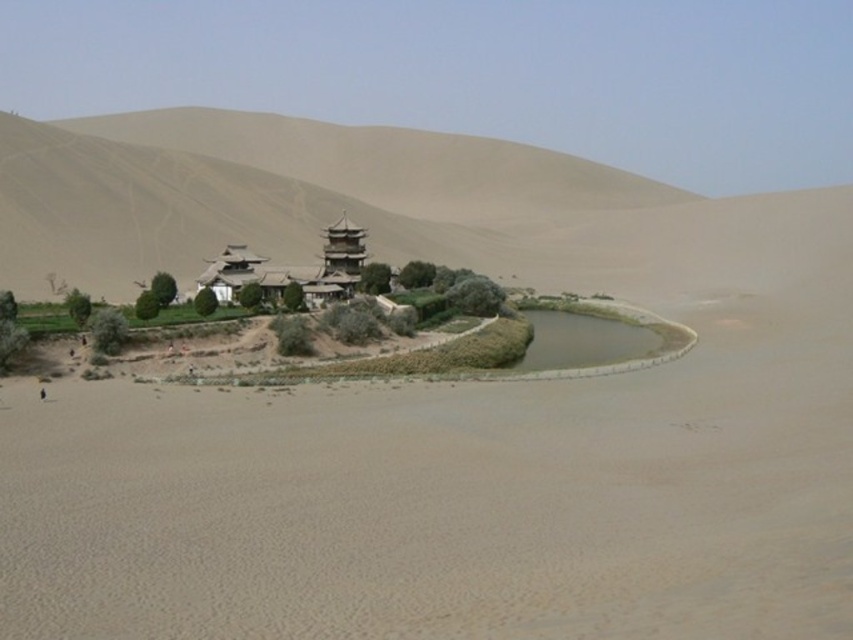
Question: Does desert sand at center appear on the right side of sandy beige hill at center?

Choices:
 (A) no
 (B) yes

Answer: (B)

Question: Among these objects, which one is nearest to the camera?

Choices:
 (A) sandy beige hill at center
 (B) desert sand at center

Answer: (B)

Question: Is desert sand at center bigger than sandy beige hill at center?

Choices:
 (A) yes
 (B) no

Answer: (B)

Question: Which object is closer to the camera taking this photo?

Choices:
 (A) sandy beige hill at center
 (B) desert sand at center

Answer: (B)

Question: From the image, what is the correct spatial relationship of desert sand at center in relation to sandy beige hill at center?

Choices:
 (A) below
 (B) above

Answer: (A)